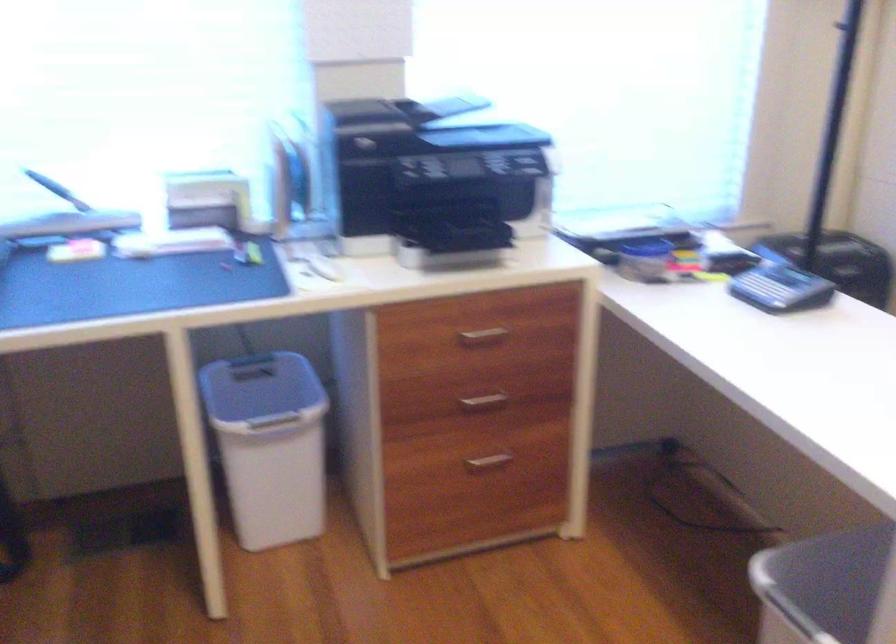
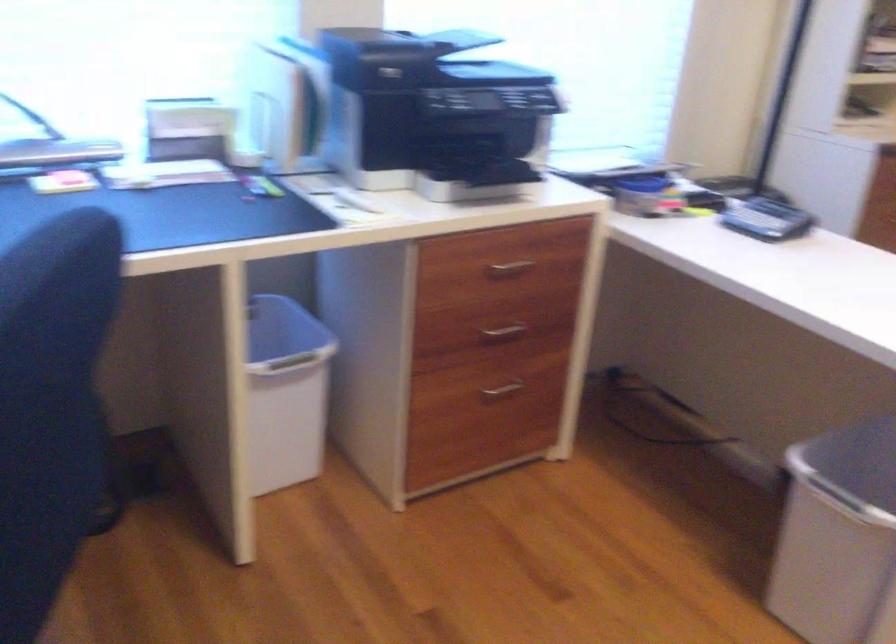
Locate, in the second image, the point that corresponds to (487,402) in the first image.

(503, 330)